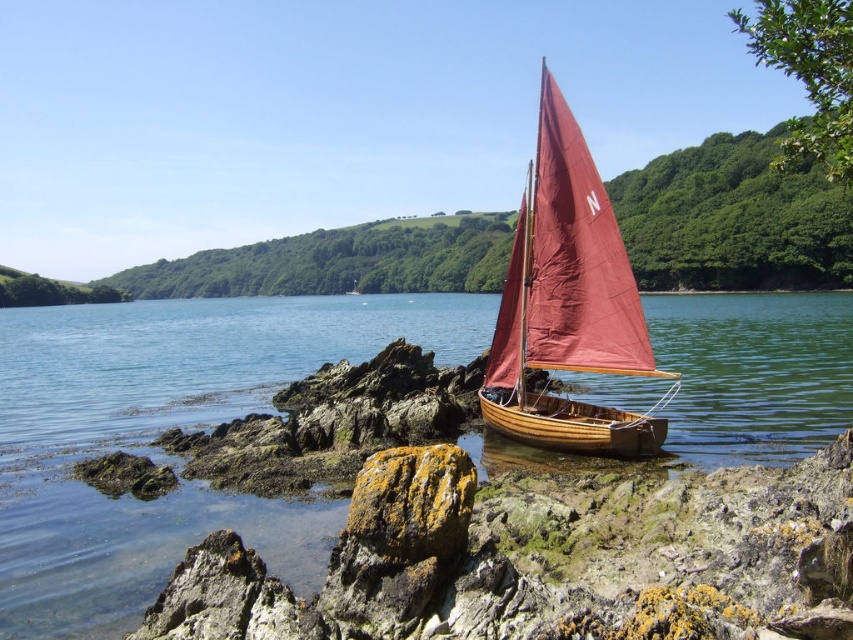
Question: Is clear water at boat right further to camera compared to wooden sailboat at center?

Choices:
 (A) yes
 (B) no

Answer: (B)

Question: Which point is closer to the camera?

Choices:
 (A) wooden sailboat at center
 (B) clear water at boat right

Answer: (B)

Question: In this image, where is clear water at boat right located relative to wooden sailboat at center?

Choices:
 (A) below
 (B) above

Answer: (B)

Question: Is clear water at boat right smaller than wooden sailboat at center?

Choices:
 (A) yes
 (B) no

Answer: (B)

Question: Which object appears closest to the camera in this image?

Choices:
 (A) clear water at boat right
 (B) wooden sailboat at center

Answer: (A)